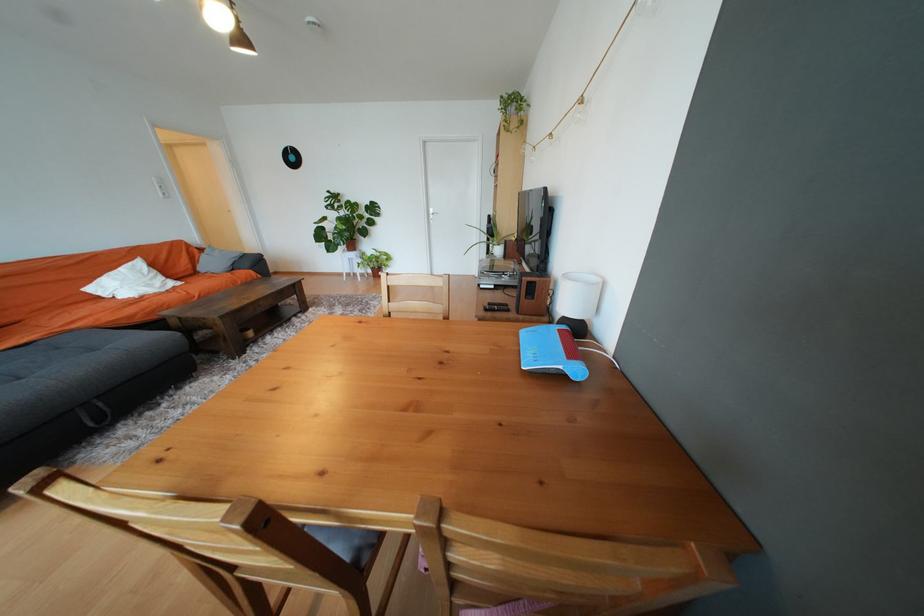
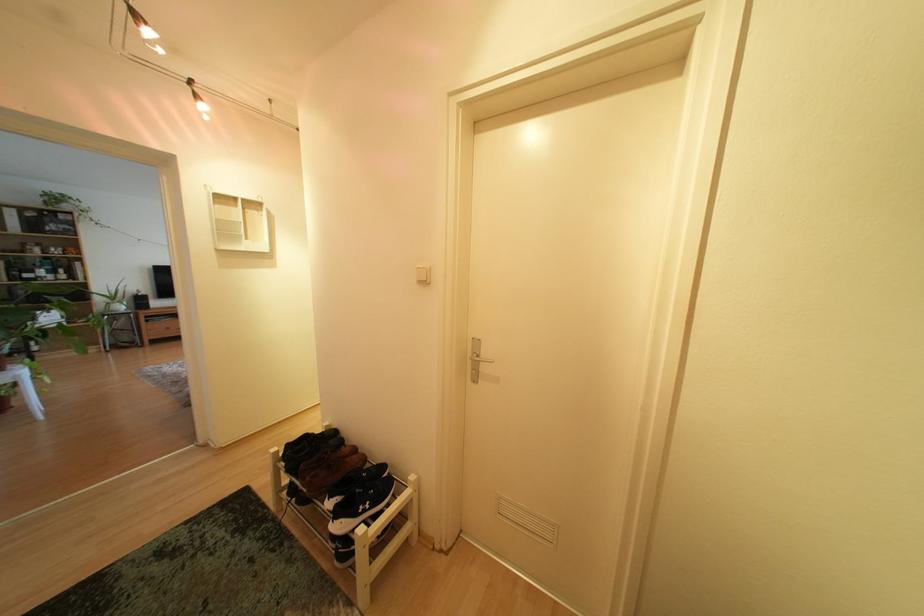
Question: I am providing you with two images of the same scene from different viewpoints. Please identify which objects are invisible in image2.

Choices:
 (A) crumpled white paper
 (B) white table lamp
 (C) silver door handle
 (D) brown leather shoe

Answer: (B)